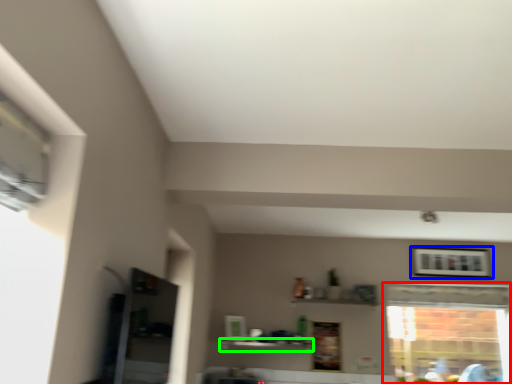
Question: Based on their relative distances, which object is nearer to window (highlighted by a red box)? Choose from picture frame (highlighted by a blue box) and shelf (highlighted by a green box).

Choices:
 (A) picture frame
 (B) shelf

Answer: (A)